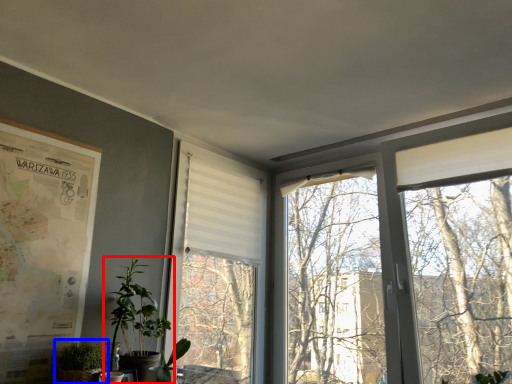
Question: Which of the following is the farthest to the observer, houseplant (highlighted by a red box) or houseplant (highlighted by a blue box)?

Choices:
 (A) houseplant
 (B) houseplant

Answer: (A)